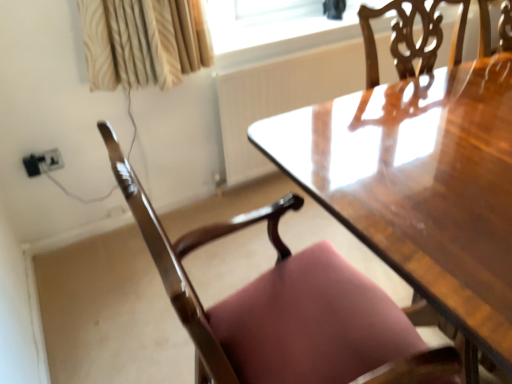
Locate an element on the screen. black plastic outlet at lower left is located at coordinates (42, 162).

This screenshot has width=512, height=384. Describe the element at coordinates (42, 162) in the screenshot. I see `black plastic outlet at lower left` at that location.

What is the approximate width of transparent glass window screen at upper center?

It is 9.09 inches.

Find the location of `transparent glass window screen at upper center`. transparent glass window screen at upper center is located at coordinates (274, 26).

You are a GUI agent. You are given a task and a screenshot of the screen. Output one action in this format:
    pyautogui.click(x=<x>, y=<y>)
    Task: Click on the black plastic outlet at lower left
    The width and height of the screenshot is (512, 384).
    Given the screenshot: What is the action you would take?
    pyautogui.click(x=42, y=162)

Which point is more forward, (314, 22) or (369, 362)?

The point (369, 362) is in front.

Measure the distance from transparent glass window screen at upper center to glossy wood chair at lower left.

transparent glass window screen at upper center is 1.15 meters away from glossy wood chair at lower left.

In terms of width, does transparent glass window screen at upper center look wider or thinner when compared to glossy wood chair at lower left?

transparent glass window screen at upper center is thinner than glossy wood chair at lower left.

From the image's perspective, is transparent glass window screen at upper center over glossy wood chair at lower left?

Yes, from the image's perspective, transparent glass window screen at upper center is above glossy wood chair at lower left.

Is point (30, 176) closer or farther from the camera than point (378, 20)?

Clearly, point (30, 176) is closer to the camera than point (378, 20).

Is black plastic outlet at lower left further to camera compared to transparent glass window screen at upper center?

No.

Between black plastic outlet at lower left and transparent glass window screen at upper center, which one has larger size?

transparent glass window screen at upper center.

You are a GUI agent. You are given a task and a screenshot of the screen. Output one action in this format:
    pyautogui.click(x=<x>, y=<y>)
    Task: Click on the electric outlet behind the glossy wood chair at lower left
    
    Given the screenshot: What is the action you would take?
    pyautogui.click(x=42, y=162)

Between glossy wood chair at lower left and black plastic outlet at lower left, which one is positioned in front?

glossy wood chair at lower left.

Is glossy wood chair at lower left not within black plastic outlet at lower left?

Yes, glossy wood chair at lower left is located beyond the bounds of black plastic outlet at lower left.

Considering the sizes of glossy wood chair at lower left and black plastic outlet at lower left in the image, is glossy wood chair at lower left wider or thinner than black plastic outlet at lower left?

In the image, glossy wood chair at lower left appears to be wider than black plastic outlet at lower left.

Measure the distance from glossy wood chair at lower left to transparent glass window screen at upper center.

The distance of glossy wood chair at lower left from transparent glass window screen at upper center is 1.15 meters.

Is point (187, 308) in front of point (340, 37)?

Yes, point (187, 308) is closer to viewer.

Does glossy wood chair at lower left appear on the left side of transparent glass window screen at upper center?

Yes, glossy wood chair at lower left is to the left of transparent glass window screen at upper center.

Is glossy wood chair at lower left smaller than transparent glass window screen at upper center?

Actually, glossy wood chair at lower left might be larger than transparent glass window screen at upper center.

Considering the sizes of objects black plastic outlet at lower left and glossy wood chair at lower left in the image provided, who is thinner, black plastic outlet at lower left or glossy wood chair at lower left?

With smaller width is black plastic outlet at lower left.

From the image's perspective, which one is positioned lower, black plastic outlet at lower left or glossy wood chair at lower left?

glossy wood chair at lower left appears lower in the image.

Can you see black plastic outlet at lower left touching glossy wood chair at lower left?

No, black plastic outlet at lower left is not making contact with glossy wood chair at lower left.

What are the coordinates of `electric outlet that is under the glossy wood chair at lower left (from a real-world perspective)` in the screenshot? It's located at (42, 162).

Considering the sizes of objects transparent glass window screen at upper center and black plastic outlet at lower left in the image provided, who is shorter, transparent glass window screen at upper center or black plastic outlet at lower left?

transparent glass window screen at upper center is shorter.

Which is more to the right, transparent glass window screen at upper center or black plastic outlet at lower left?

Positioned to the right is transparent glass window screen at upper center.

From the image's perspective, is transparent glass window screen at upper center located beneath black plastic outlet at lower left?

No, from the image's perspective, transparent glass window screen at upper center is not beneath black plastic outlet at lower left.

Image resolution: width=512 pixels, height=384 pixels. What are the coordinates of `window screen positioned vertically above the black plastic outlet at lower left (from a real-world perspective)` in the screenshot? It's located at (274, 26).

This screenshot has width=512, height=384. I want to click on window screen above the glossy wood chair at lower left (from the image's perspective), so coord(274,26).

Where is `electric outlet lying on the left of transparent glass window screen at upper center`? This screenshot has height=384, width=512. electric outlet lying on the left of transparent glass window screen at upper center is located at coordinates (42, 162).

Estimate the real-world distances between objects in this image. Which object is further from black plastic outlet at lower left, transparent glass window screen at upper center or glossy wood chair at lower left?

The object further to black plastic outlet at lower left is glossy wood chair at lower left.

Based on the photo, estimate the real-world distances between objects in this image. Which object is closer to transparent glass window screen at upper center, glossy wood chair at lower left or black plastic outlet at lower left?

Among the two, black plastic outlet at lower left is located nearer to transparent glass window screen at upper center.

Considering their positions, is transparent glass window screen at upper center positioned further to glossy wood chair at lower left than black plastic outlet at lower left?

black plastic outlet at lower left is further to glossy wood chair at lower left.

Estimate the real-world distances between objects in this image. Which object is closer to glossy wood chair at lower left, black plastic outlet at lower left or transparent glass window screen at upper center?

Based on the image, transparent glass window screen at upper center appears to be nearer to glossy wood chair at lower left.

Which object lies further to the anchor point black plastic outlet at lower left, glossy wood chair at lower left or transparent glass window screen at upper center?

Based on the image, glossy wood chair at lower left appears to be further to black plastic outlet at lower left.

Looking at the image, which one is located closer to transparent glass window screen at upper center, black plastic outlet at lower left or glossy wood chair at lower left?

Based on the image, black plastic outlet at lower left appears to be nearer to transparent glass window screen at upper center.

The image size is (512, 384). I want to click on electric outlet between glossy wood chair at lower left and transparent glass window screen at upper center in the front-back direction, so click(x=42, y=162).